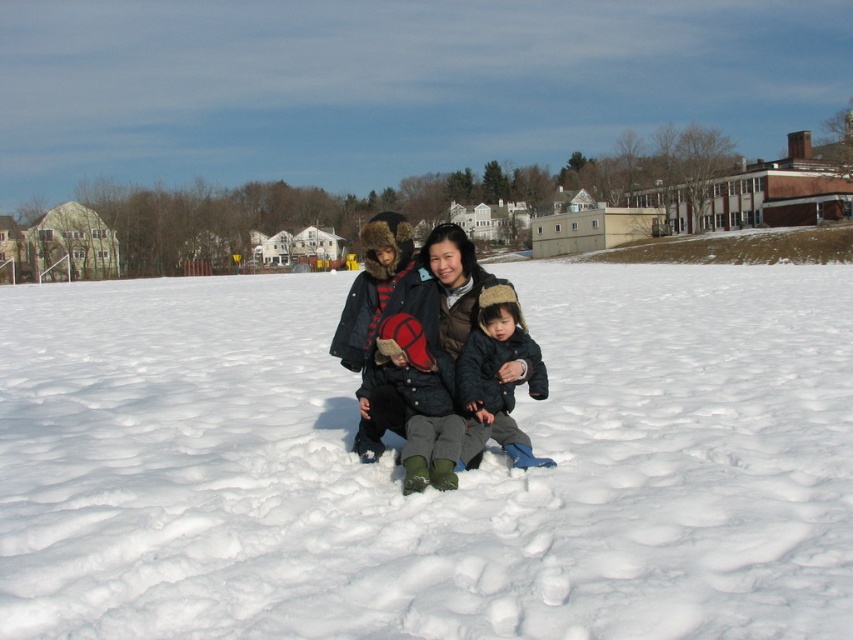
Question: Which point is farther from the camera taking this photo?

Choices:
 (A) (375, 417)
 (B) (531, 385)
 (C) (595, 582)
 (D) (361, 387)

Answer: (D)

Question: Can you confirm if velvet red mittens at center is thinner than fluffy gray hat at center?

Choices:
 (A) no
 (B) yes

Answer: (A)

Question: Observing the image, what is the correct spatial positioning of white fluffy snow at center in reference to matte black jacket at center?

Choices:
 (A) above
 (B) below

Answer: (A)

Question: Is white fluffy snow at center closer to camera compared to velvet red mittens at center?

Choices:
 (A) no
 (B) yes

Answer: (B)

Question: Estimate the real-world distances between objects in this image. Which object is closer to the white fluffy snow at center?

Choices:
 (A) velvet red mittens at center
 (B) matte black jacket at center

Answer: (A)

Question: Considering the real-world distances, which object is closest to the matte black jacket at center?

Choices:
 (A) white fluffy snow at center
 (B) fluffy gray hat at center
 (C) velvet red mittens at center

Answer: (B)